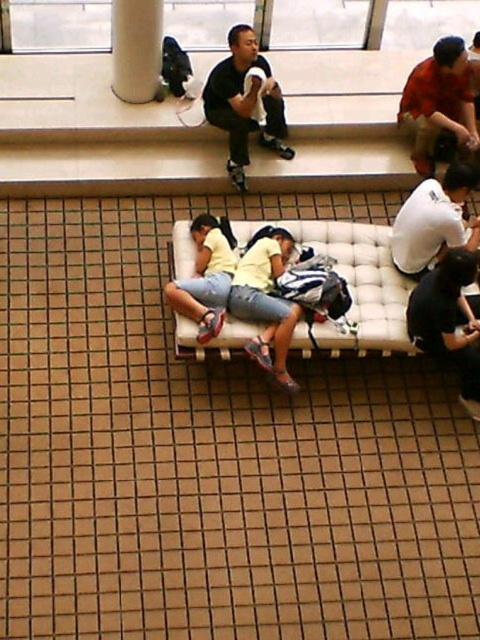
Consider the image. You are standing at the entrance of the train station and want to find the white matte shirt at center. According to the coordinates provided, in which direction should you look relative to your current position?

The white matte shirt at center is located at coordinates point (434,220), which means you should look towards the lower middle area of the scene from your current position at the entrance.

You are standing in the train station and see the black matte shirt at upper center and the white glossy pillar at upper center. Which object is closer to you?

The black matte shirt at upper center is closer to you than the white glossy pillar at upper center.

You are standing at the point labeled point (244, 102) in the image. What object are you currently touching?

The point labeled point (244, 102) is on the black matte shirt at upper center, so you are touching the black matte shirt at upper center.